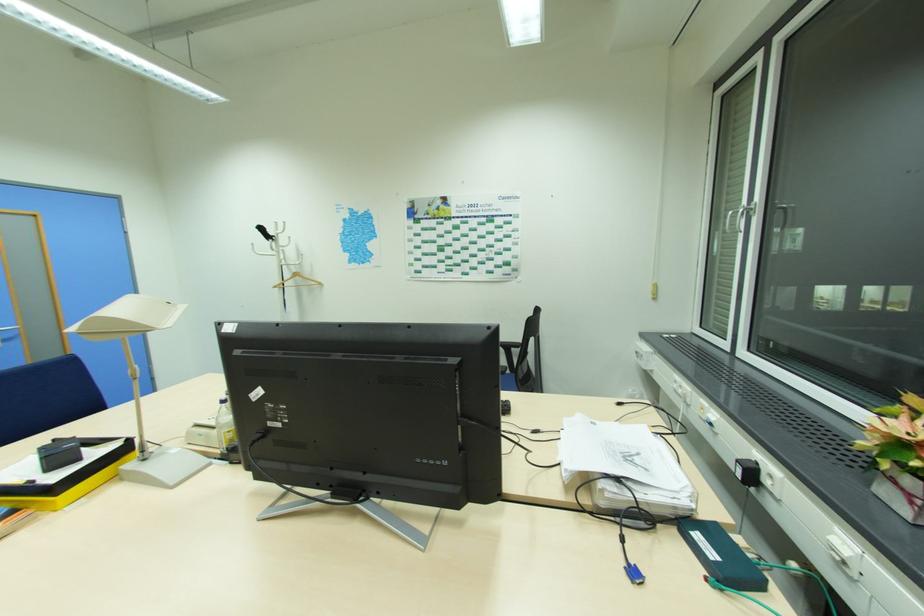
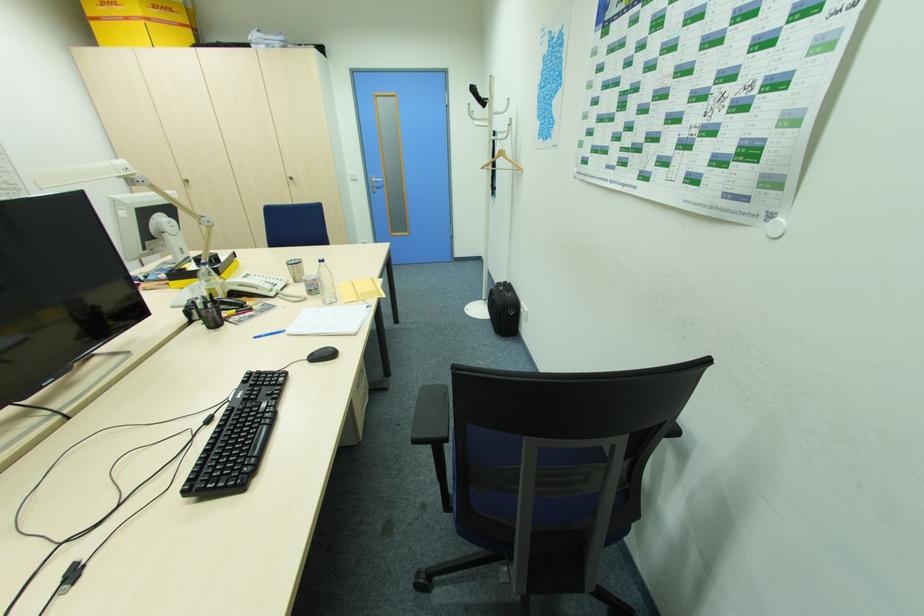
Find the pixel in the second image that matches the point at 61,495 in the first image.

(173, 281)